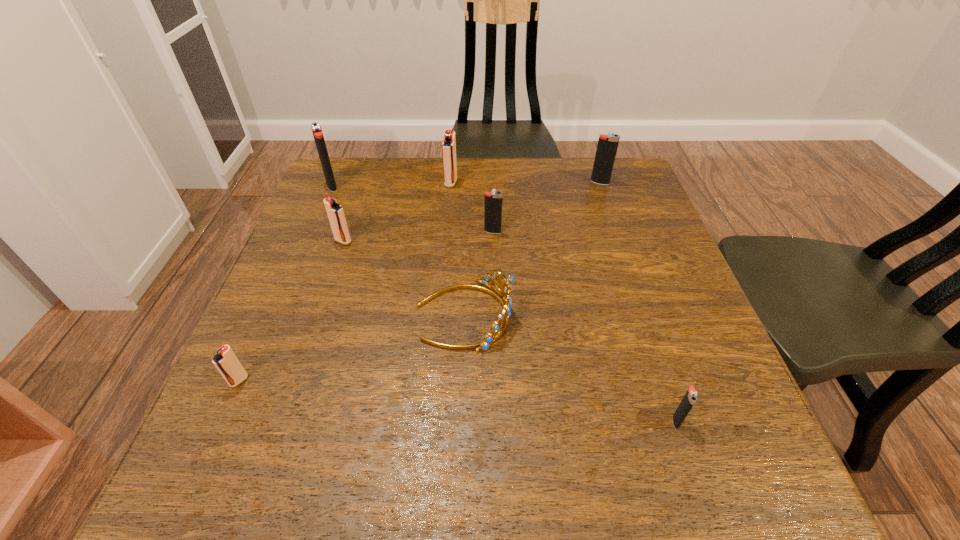
Locate an element on the screen. The width and height of the screenshot is (960, 540). vacant region located 0.330m on the front-facing side of the third nearest object is located at coordinates (675, 315).

Where is `free space located on the back of the leftmost red igniter`? The image size is (960, 540). free space located on the back of the leftmost red igniter is located at coordinates (276, 299).

The image size is (960, 540). In order to click on free point located 0.200m on the back of the smallest black igniter in this screenshot , I will do `click(642, 320)`.

You are a GUI agent. You are given a task and a screenshot of the screen. Output one action in this format:
    pyautogui.click(x=<x>, y=<y>)
    Task: Click on the object located at the far left corner
    The image size is (960, 540).
    Given the screenshot: What is the action you would take?
    point(318,136)

What are the coordinates of `object at the far right corner` in the screenshot? It's located at (607, 146).

In the image, there is a desktop. Where is `free space at the far edge`? free space at the far edge is located at coordinates (537, 191).

Where is `vacant region at the left edge of the desktop`? vacant region at the left edge of the desktop is located at coordinates (318, 214).

Locate an element on the screen. The height and width of the screenshot is (540, 960). vacant area at the right edge of the desktop is located at coordinates (696, 411).

This screenshot has height=540, width=960. In the image, there is a desktop. Find the location of `vacant space at the near left corner`. vacant space at the near left corner is located at coordinates (294, 458).

You are a GUI agent. You are given a task and a screenshot of the screen. Output one action in this format:
    pyautogui.click(x=<x>, y=<y>)
    Task: Click on the free spot at the far right corner of the desktop
    The height and width of the screenshot is (540, 960).
    Given the screenshot: What is the action you would take?
    pyautogui.click(x=590, y=188)